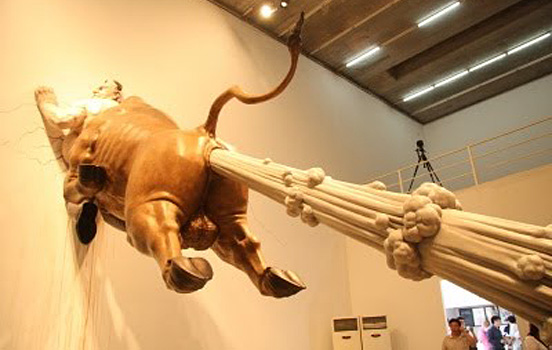
Locate an element on the screen. This screenshot has height=350, width=552. ceiling is located at coordinates (426, 47).